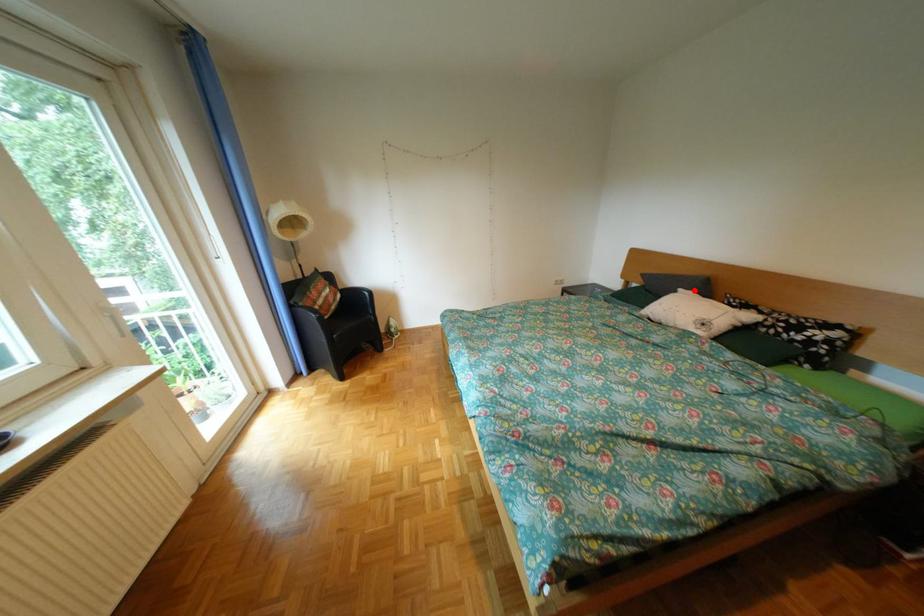
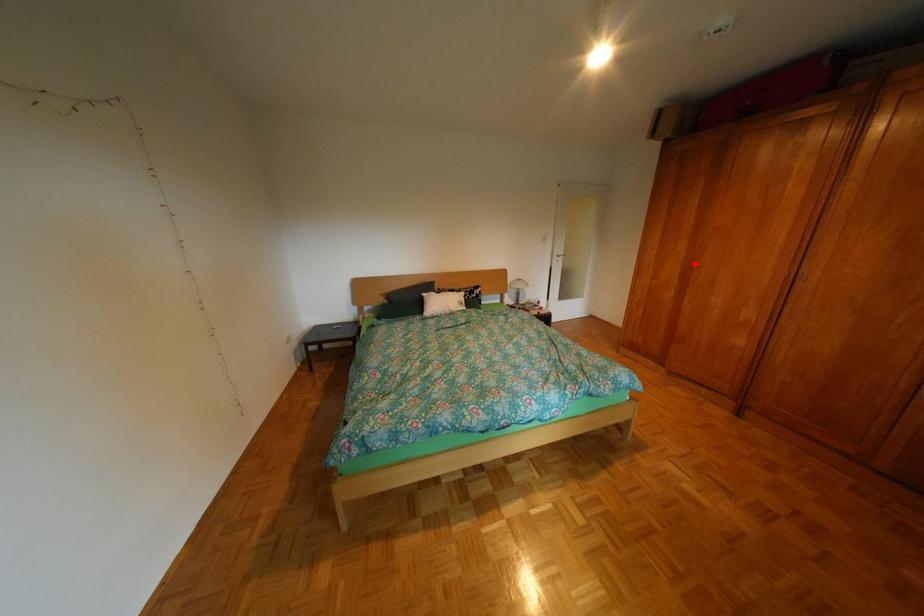
I am providing you with two images of the same scene from different viewpoints. A red point is marked on the first image and another point is marked on the second image. Do the highlighted points in image1 and image2 indicate the same real-world spot?

No